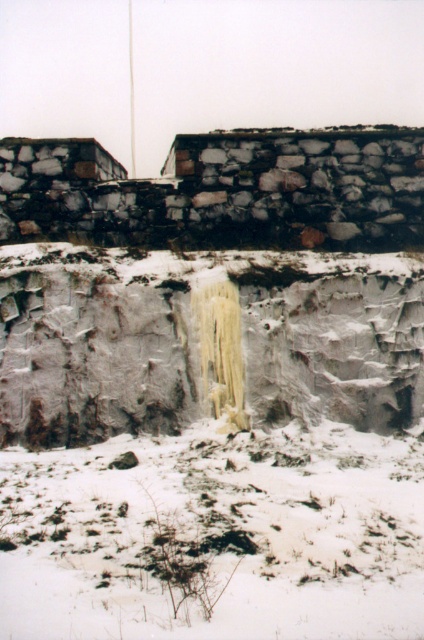
Looking at this image, is white powdery snow at lower center to the right of metallic flag pole at upper center from the viewer's perspective?

Yes, white powdery snow at lower center is to the right of metallic flag pole at upper center.

Can you confirm if white powdery snow at lower center is smaller than metallic flag pole at upper center?

Correct, white powdery snow at lower center occupies less space than metallic flag pole at upper center.

Does point (410, 557) come closer to viewer compared to point (128, 4)?

That is True.

Find the location of a particular element. This screenshot has width=424, height=640. white powdery snow at lower center is located at coordinates (215, 536).

Based on the photo, who is higher up, white powdery snow at lower center or white rock cliff at center?

white rock cliff at center

Who is positioned more to the left, white powdery snow at lower center or white rock cliff at center?

white powdery snow at lower center

Image resolution: width=424 pixels, height=640 pixels. Describe the element at coordinates (215, 536) in the screenshot. I see `white powdery snow at lower center` at that location.

Where is `white powdery snow at lower center`? white powdery snow at lower center is located at coordinates (215, 536).

Between point (89, 384) and point (42, 232), which one is positioned in front?

Positioned in front is point (89, 384).

Between white rock cliff at center and rough stone wall at upper center, which one appears on the right side from the viewer's perspective?

From the viewer's perspective, white rock cliff at center appears more on the right side.

This screenshot has height=640, width=424. Find the location of `white rock cliff at center`. white rock cliff at center is located at coordinates (204, 340).